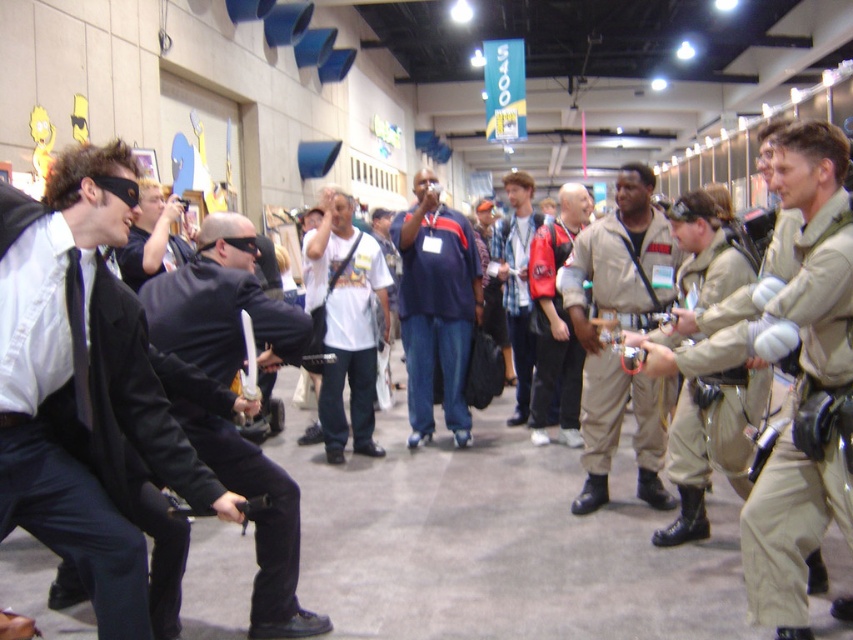
Does khaki cotton jumpsuit at center appear on the right side of white cotton t-shirt at center?

Correct, you'll find khaki cotton jumpsuit at center to the right of white cotton t-shirt at center.

This screenshot has height=640, width=853. What do you see at coordinates (630, 326) in the screenshot?
I see `khaki cotton jumpsuit at center` at bounding box center [630, 326].

You are a GUI agent. You are given a task and a screenshot of the screen. Output one action in this format:
    pyautogui.click(x=<x>, y=<y>)
    Task: Click on the khaki cotton jumpsuit at center
    
    Given the screenshot: What is the action you would take?
    pyautogui.click(x=630, y=326)

At what (x,y) coordinates should I click in order to perform the action: click on khaki cotton jumpsuit at center. Please return your answer as a coordinate pair (x, y). Looking at the image, I should click on (630, 326).

Which is more to the left, khaki cotton jumpsuit at center-right or plaid shirt at center?

Positioned to the left is plaid shirt at center.

Is khaki cotton jumpsuit at center-right shorter than plaid shirt at center?

Incorrect, khaki cotton jumpsuit at center-right's height does not fall short of plaid shirt at center's.

At what (x,y) coordinates should I click in order to perform the action: click on khaki cotton jumpsuit at center-right. Please return your answer as a coordinate pair (x, y). Image resolution: width=853 pixels, height=640 pixels. Looking at the image, I should click on (793, 276).

Is khaki cotton jumpsuit at center-right further to camera compared to white cotton t-shirt at center?

That is False.

Between point (795, 605) and point (305, 276), which one is positioned in front?

Point (795, 605) is in front.

Identify the location of khaki cotton jumpsuit at center-right. (793, 276).